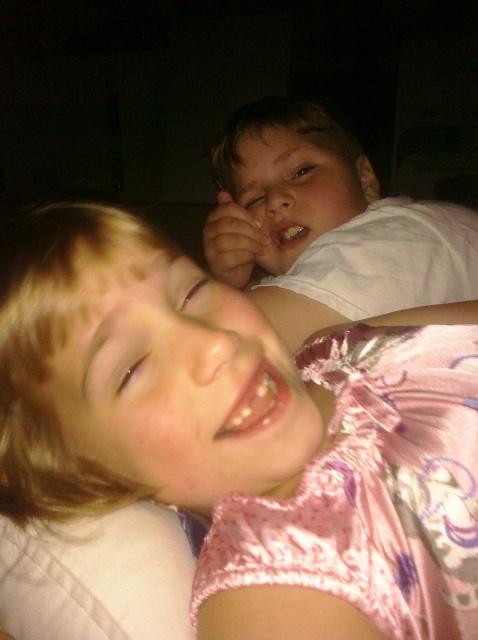
Is the position of pink satin face at lower left less distant than that of white glossy teeth at lower center?

Yes.

Which of these two, pink satin face at lower left or white glossy teeth at lower center, stands taller?

Standing taller between the two is pink satin face at lower left.

The width and height of the screenshot is (478, 640). I want to click on pink satin face at lower left, so click(x=183, y=385).

Who is shorter, pink satin dress at center or pink satin face at lower left?

Standing shorter between the two is pink satin face at lower left.

Is point (178, 397) more distant than point (260, 481)?

No, (178, 397) is in front of (260, 481).

At what (x,y) coordinates should I click in order to perform the action: click on pink satin dress at center. Please return your answer as a coordinate pair (x, y). The width and height of the screenshot is (478, 640). Looking at the image, I should click on (239, 436).

Who is lower down, white cotton shirt at upper center or white glossy teeth at lower center?

white glossy teeth at lower center is lower down.

Can you confirm if white cotton shirt at upper center is smaller than white glossy teeth at lower center?

Actually, white cotton shirt at upper center might be larger than white glossy teeth at lower center.

Locate an element on the screen. This screenshot has width=478, height=640. white cotton shirt at upper center is located at coordinates (326, 225).